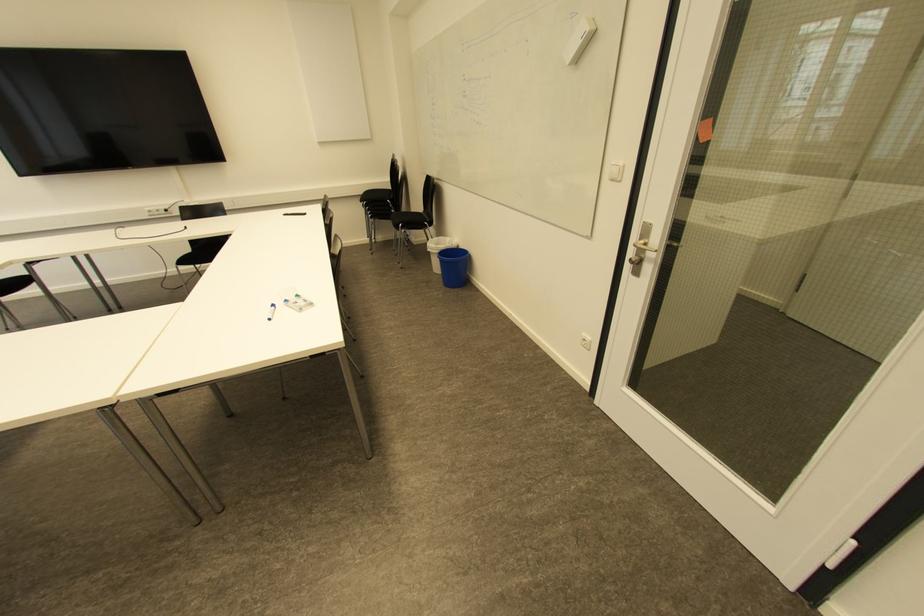
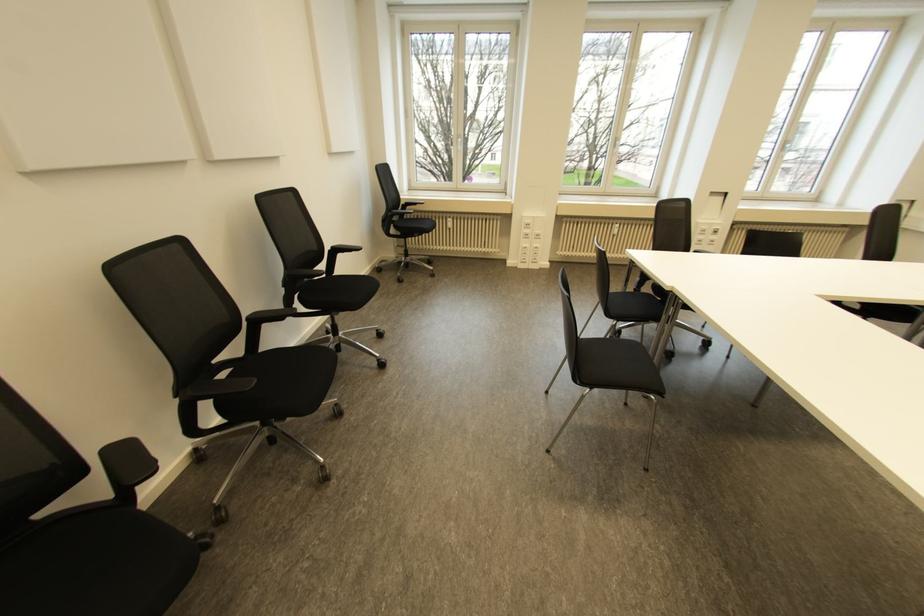
The first image is from the beginning of the video and the second image is from the end. How did the camera likely rotate when shooting the video?

The rotation direction of the camera is left-down.